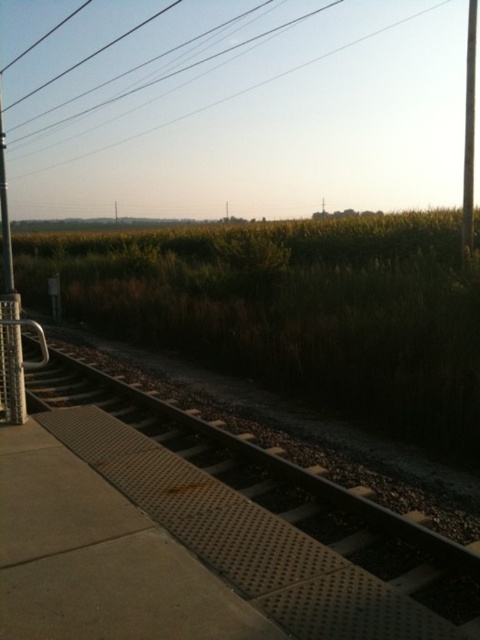
Which is below, brown textured track at center or metallic pole at right?

Positioned lower is brown textured track at center.

Is point (392, 529) farther from camera compared to point (469, 26)?

No, it is not.

Find the location of a particular element. The height and width of the screenshot is (640, 480). brown textured track at center is located at coordinates (265, 518).

Which is in front, point (324, 8) or point (467, 77)?

Positioned in front is point (324, 8).

Can you confirm if metallic wires at upper center is smaller than metallic pole at right?

Correct, metallic wires at upper center occupies less space than metallic pole at right.

The image size is (480, 640). What do you see at coordinates (242, 90) in the screenshot?
I see `metallic wires at upper center` at bounding box center [242, 90].

This screenshot has width=480, height=640. In order to click on metallic wires at upper center in this screenshot , I will do `click(242, 90)`.

From the picture: Can you confirm if brown textured track at center is shorter than metallic wires at upper center?

Yes.

Is brown textured track at center bigger than metallic wires at upper center?

No, brown textured track at center is not bigger than metallic wires at upper center.

Is point (317, 486) more distant than point (87, 108)?

No, (317, 486) is closer to viewer.

Image resolution: width=480 pixels, height=640 pixels. I want to click on brown textured track at center, so click(265, 518).